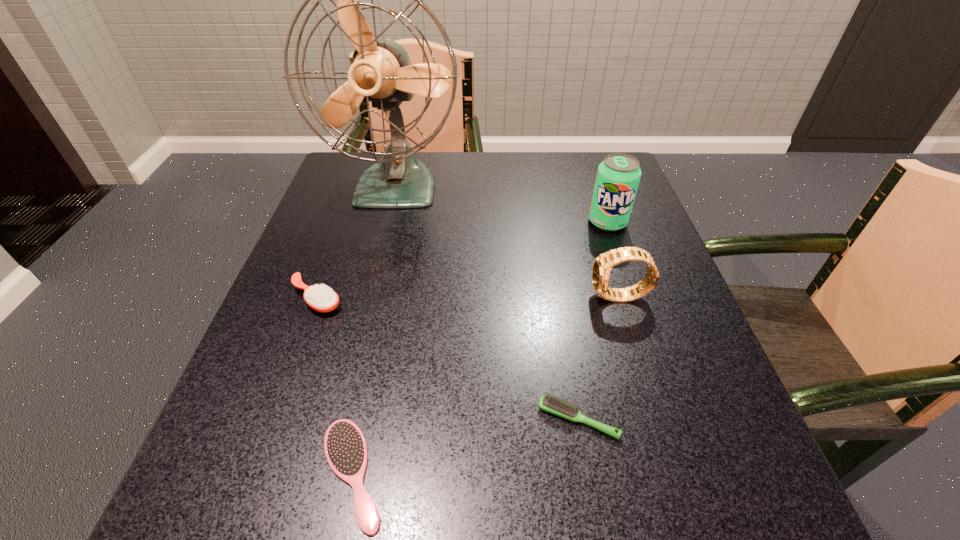
Locate an element on the screen. The width and height of the screenshot is (960, 540). free space between the third tallest object and the tallest hairbrush is located at coordinates (468, 298).

Image resolution: width=960 pixels, height=540 pixels. Find the location of `free point between the second hairbrush from left to right and the farthest hairbrush`. free point between the second hairbrush from left to right and the farthest hairbrush is located at coordinates (334, 386).

Identify the location of vacant space that is in between the fan and the fifth shortest object. (502, 204).

What are the coordinates of `free space between the third object from right to left and the second hairbrush from right to left` in the screenshot? It's located at (466, 446).

Find the location of a particular element. This screenshot has width=960, height=540. vacant point located between the fourth tallest object and the fan is located at coordinates (357, 242).

I want to click on free space that is in between the third tallest object and the third shortest object, so click(x=468, y=298).

Locate an element on the screen. vacant space that is in between the watch and the farthest hairbrush is located at coordinates (468, 298).

Where is `vacant space in between the second hairbrush from left to right and the fan`? vacant space in between the second hairbrush from left to right and the fan is located at coordinates (374, 330).

Identify which object is the fifth nearest to the rightmost hairbrush. Please provide its 2D coordinates. Your answer should be formatted as a tuple, i.e. [(x, y)], where the tuple contains the x and y coordinates of a point satisfying the conditions above.

[(381, 71)]

You are a GUI agent. You are given a task and a screenshot of the screen. Output one action in this format:
    pyautogui.click(x=<x>, y=<y>)
    Task: Click on the fourth closest object to the rightmost hairbrush
    Image resolution: width=960 pixels, height=540 pixels.
    Given the screenshot: What is the action you would take?
    pyautogui.click(x=618, y=176)